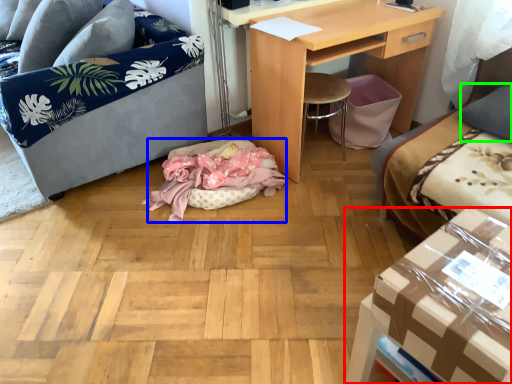
Question: Based on their relative distances, which object is nearer to table (highlighted by a red box)? Choose from cat bed (highlighted by a blue box) and pillow (highlighted by a green box).

Choices:
 (A) cat bed
 (B) pillow

Answer: (B)